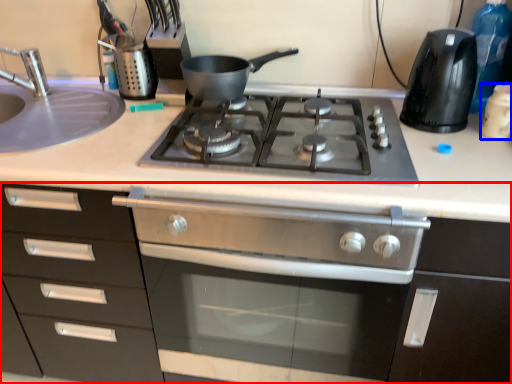
Question: Which object appears farthest to the camera in this image, cabinetry (highlighted by a red box) or kitchen appliance (highlighted by a blue box)?

Choices:
 (A) cabinetry
 (B) kitchen appliance

Answer: (B)